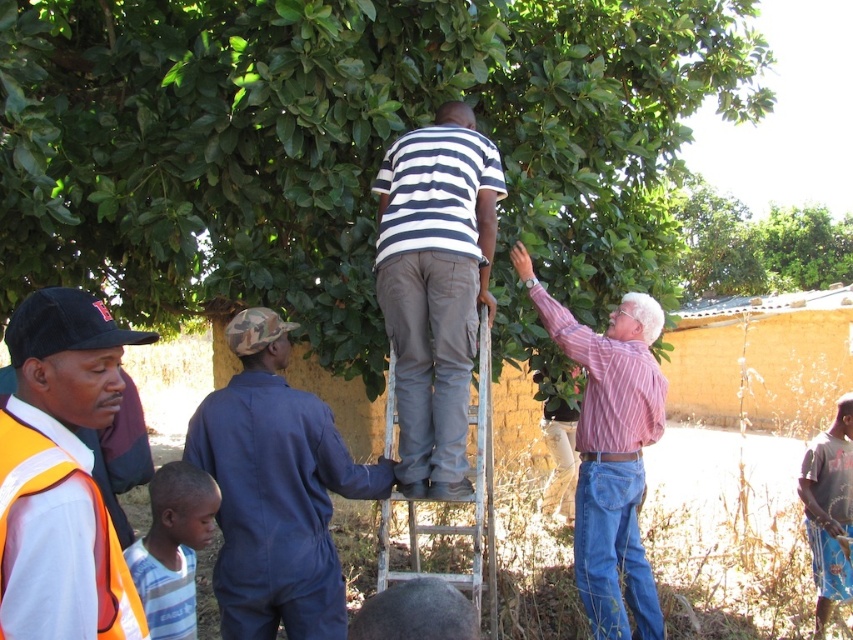
Question: Which of the following is the farthest from the observer?

Choices:
 (A) (444, 348)
 (B) (389, 499)

Answer: (A)

Question: Based on their relative distances, which object is farther from the green leafy tree at upper center?

Choices:
 (A) pink striped shirt at upper right
 (B) metallic silver ladder at center

Answer: (A)

Question: Which point is closer to the camera taking this photo?

Choices:
 (A) (332, 456)
 (B) (840, 516)

Answer: (A)

Question: Does blue coveralls at center lie behind pink striped shirt at upper right?

Choices:
 (A) yes
 (B) no

Answer: (B)

Question: Does blue coveralls at center come behind metallic silver ladder at center?

Choices:
 (A) yes
 (B) no

Answer: (A)

Question: Does striped cotton shirt at center come behind orange reflective safety vest at left?

Choices:
 (A) no
 (B) yes

Answer: (B)